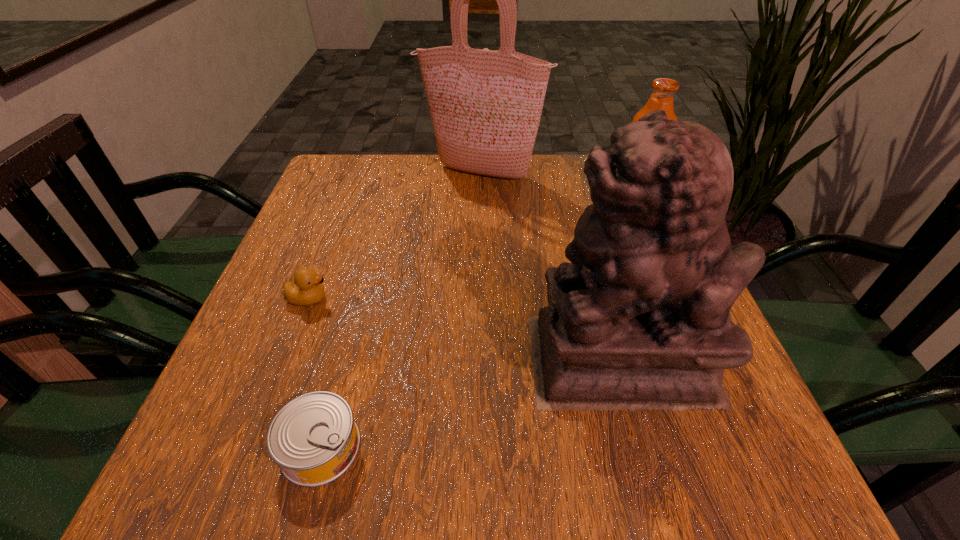
Find the location of a particular element. duckling that is at the left edge is located at coordinates (307, 289).

Locate an element on the screen. Image resolution: width=960 pixels, height=540 pixels. can at the left edge is located at coordinates (314, 439).

In order to click on sculpture that is at the right edge in this screenshot , I will do `click(640, 319)`.

Locate an element on the screen. The image size is (960, 540). fruit juice that is at the right edge is located at coordinates (663, 89).

The height and width of the screenshot is (540, 960). I want to click on object at the near left corner, so click(314, 439).

Locate an element on the screen. Image resolution: width=960 pixels, height=540 pixels. object situated at the far right corner is located at coordinates (663, 89).

Locate an element on the screen. vacant space at the far edge is located at coordinates (418, 177).

In the image, there is a desktop. What are the coordinates of `vacant space at the near edge` in the screenshot? It's located at (561, 467).

In the image, there is a desktop. Identify the location of vacant space at the left edge. The image size is (960, 540). (324, 301).

The image size is (960, 540). Find the location of `vacant space at the right edge of the desktop`. vacant space at the right edge of the desktop is located at coordinates (716, 423).